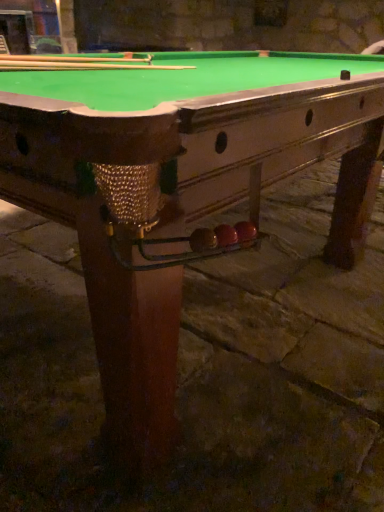
Question: Should I look upward or downward to see smooth wood cue at upper left, which is counted as the 2th cue, starting from the front?

Choices:
 (A) down
 (B) up

Answer: (B)

Question: Is wooden cue at upper center, the second cue when ordered from back to front, closer to camera compared to smooth wood cue at upper left, acting as the 1th cue starting from the back?

Choices:
 (A) no
 (B) yes

Answer: (B)

Question: From the image's perspective, is wooden cue at upper center, the second cue when ordered from back to front, under smooth wood cue at upper left, which is counted as the 2th cue, starting from the front?

Choices:
 (A) yes
 (B) no

Answer: (B)

Question: Is wooden cue at upper center, the second cue when ordered from back to front, to the right of smooth wood cue at upper left, acting as the 1th cue starting from the back, from the viewer's perspective?

Choices:
 (A) yes
 (B) no

Answer: (B)

Question: Considering the relative sizes of wooden cue at upper center, the second cue when ordered from back to front, and smooth wood cue at upper left, acting as the 1th cue starting from the back, in the image provided, is wooden cue at upper center, the second cue when ordered from back to front, shorter than smooth wood cue at upper left, acting as the 1th cue starting from the back,?

Choices:
 (A) no
 (B) yes

Answer: (A)

Question: Is smooth wood cue at upper left, which is counted as the 2th cue, starting from the front, a part of wooden cue at upper center, the second cue when ordered from back to front?

Choices:
 (A) no
 (B) yes

Answer: (A)

Question: Is smooth wood cue at upper left, which is counted as the 2th cue, starting from the front, outside of wooden cue at upper center, marked as the first cue in a front-to-back arrangement?

Choices:
 (A) no
 (B) yes

Answer: (B)

Question: Is smooth wood cue at upper left, which is counted as the 2th cue, starting from the front, thinner than wooden cue at upper center, the second cue when ordered from back to front?

Choices:
 (A) yes
 (B) no

Answer: (B)

Question: From a real-world perspective, is smooth wood cue at upper left, acting as the 1th cue starting from the back, on wooden cue at upper center, the second cue when ordered from back to front?

Choices:
 (A) yes
 (B) no

Answer: (B)

Question: Does smooth wood cue at upper left, acting as the 1th cue starting from the back, have a lesser height compared to wooden cue at upper center, the second cue when ordered from back to front?

Choices:
 (A) no
 (B) yes

Answer: (B)

Question: Is smooth wood cue at upper left, acting as the 1th cue starting from the back, aimed at wooden cue at upper center, marked as the first cue in a front-to-back arrangement?

Choices:
 (A) no
 (B) yes

Answer: (A)

Question: Considering the relative sizes of smooth wood cue at upper left, acting as the 1th cue starting from the back, and wooden cue at upper center, the second cue when ordered from back to front, in the image provided, is smooth wood cue at upper left, acting as the 1th cue starting from the back, bigger than wooden cue at upper center, the second cue when ordered from back to front,?

Choices:
 (A) yes
 (B) no

Answer: (B)

Question: Looking at the image, does smooth wood cue at upper left, which is counted as the 2th cue, starting from the front, seem bigger or smaller compared to wooden cue at upper center, the second cue when ordered from back to front?

Choices:
 (A) small
 (B) big

Answer: (A)